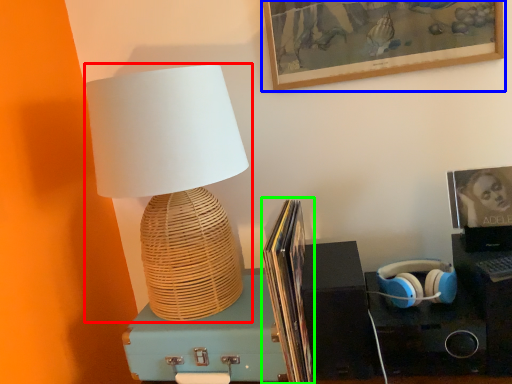
Question: Considering the real-world distances, which object is farthest from lamp (highlighted by a red box)? picture frame (highlighted by a blue box) or book (highlighted by a green box)?

Choices:
 (A) picture frame
 (B) book

Answer: (A)